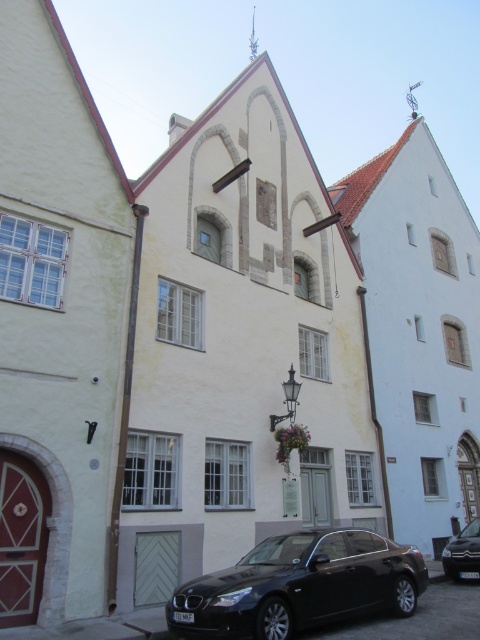
Question: Among these points, which one is farthest from the camera?

Choices:
 (A) (267, 616)
 (B) (393, 241)
 (C) (479, 566)

Answer: (B)

Question: Can you confirm if black metallic car at lower center is wider than black glossy car at lower center?

Choices:
 (A) yes
 (B) no

Answer: (A)

Question: Which point appears farthest from the camera in this image?

Choices:
 (A) (447, 365)
 (B) (468, 556)

Answer: (A)

Question: Is black metallic car at lower center closer to camera compared to black glossy car at lower center?

Choices:
 (A) no
 (B) yes

Answer: (B)

Question: Is black metallic car at lower center thinner than black glossy car at lower center?

Choices:
 (A) no
 (B) yes

Answer: (A)

Question: Which object is the closest to the black glossy car at lower center?

Choices:
 (A) black metallic car at lower center
 (B) light blue stone church at center

Answer: (A)